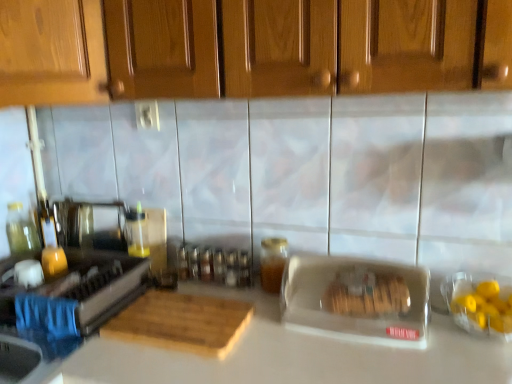
You are a GUI agent. You are given a task and a screenshot of the screen. Output one action in this format:
    pyautogui.click(x=<x>, y=<y>)
    Task: Click on the free point above white matte countertop at center (from a real-world perspective)
    The width and height of the screenshot is (512, 384).
    Given the screenshot: What is the action you would take?
    pyautogui.click(x=317, y=339)